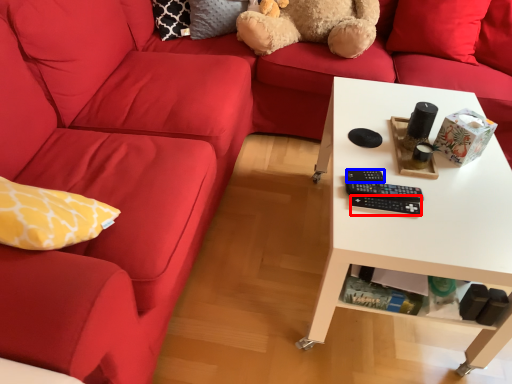
Question: Among these objects, which one is nearest to the camera, control (highlighted by a red box) or control (highlighted by a blue box)?

Choices:
 (A) control
 (B) control

Answer: (A)